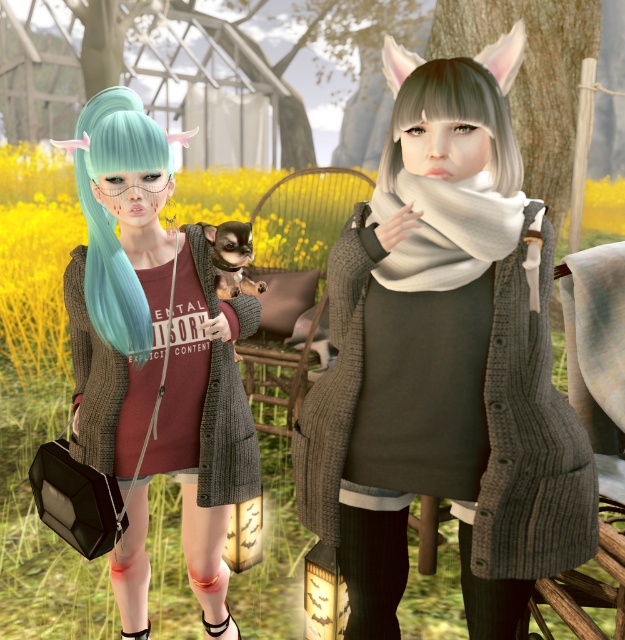
What do you see at coordinates (446, 230) in the screenshot? This screenshot has height=640, width=625. I see `white soft scarf at center` at bounding box center [446, 230].

Is point (456, 230) positioned before point (509, 188)?

Yes, point (456, 230) is closer to viewer.

Which is behind, point (434, 260) or point (508, 150)?

Point (508, 150)

You are a GUI agent. You are given a task and a screenshot of the screen. Output one action in this format:
    pyautogui.click(x=<x>, y=<y>)
    Task: Click on the white soft scarf at center
    The width and height of the screenshot is (625, 640).
    Given the screenshot: What is the action you would take?
    pyautogui.click(x=446, y=230)

Can you confirm if knitted gray sweater at center is positioned to the right of teal matte hair at left?

Yes, knitted gray sweater at center is to the right of teal matte hair at left.

Is knitted gray sweater at center behind teal matte hair at left?

No, knitted gray sweater at center is closer to the viewer.

Is point (346, 621) positioned in front of point (138, 145)?

No, it is behind (138, 145).

You are a GUI agent. You are given a task and a screenshot of the screen. Output one action in this format:
    pyautogui.click(x=<x>, y=<y>)
    Task: Click on the knitted gray sweater at center
    
    Given the screenshot: What is the action you would take?
    pyautogui.click(x=445, y=360)

Who is positioned more to the left, teal matte hair at left or white soft scarf at center?

teal matte hair at left is more to the left.

Which of these two, teal matte hair at left or white soft scarf at center, stands shorter?

white soft scarf at center is shorter.

Is point (112, 248) farther from viewer compared to point (415, 237)?

Yes, point (112, 248) is behind point (415, 237).

You are a GUI agent. You are given a task and a screenshot of the screen. Output one action in this format:
    pyautogui.click(x=<x>, y=<y>)
    Task: Click on the teal matte hair at left
    The height and width of the screenshot is (640, 625).
    Given the screenshot: What is the action you would take?
    [x=112, y=216]